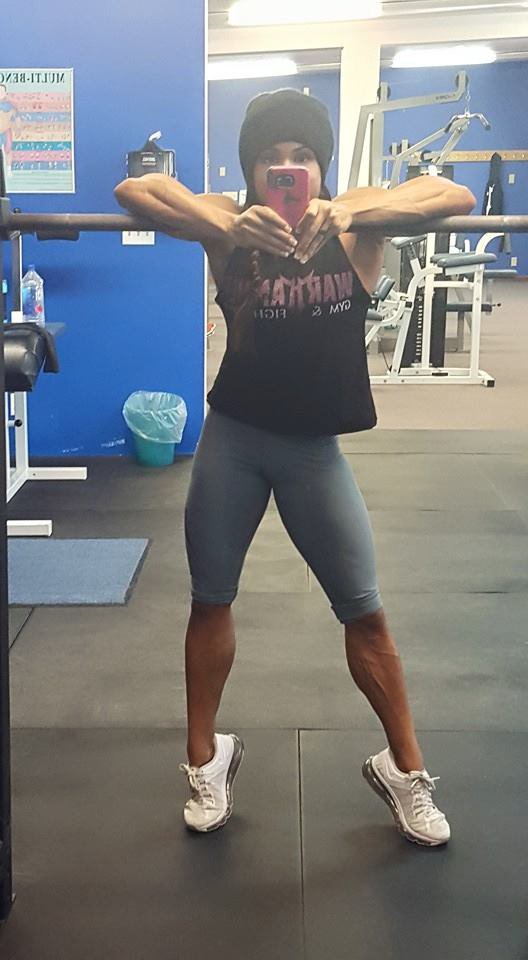
Where is `light switch`? Image resolution: width=528 pixels, height=960 pixels. light switch is located at coordinates (141, 237).